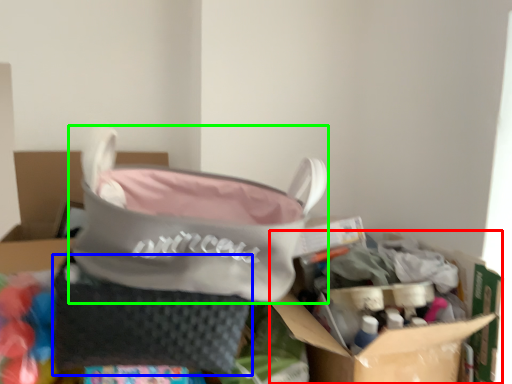
Question: Considering the real-world distances, which object is closest to cardboard box (highlighted by a red box)? pouch (highlighted by a blue box) or handbag (highlighted by a green box).

Choices:
 (A) pouch
 (B) handbag

Answer: (B)